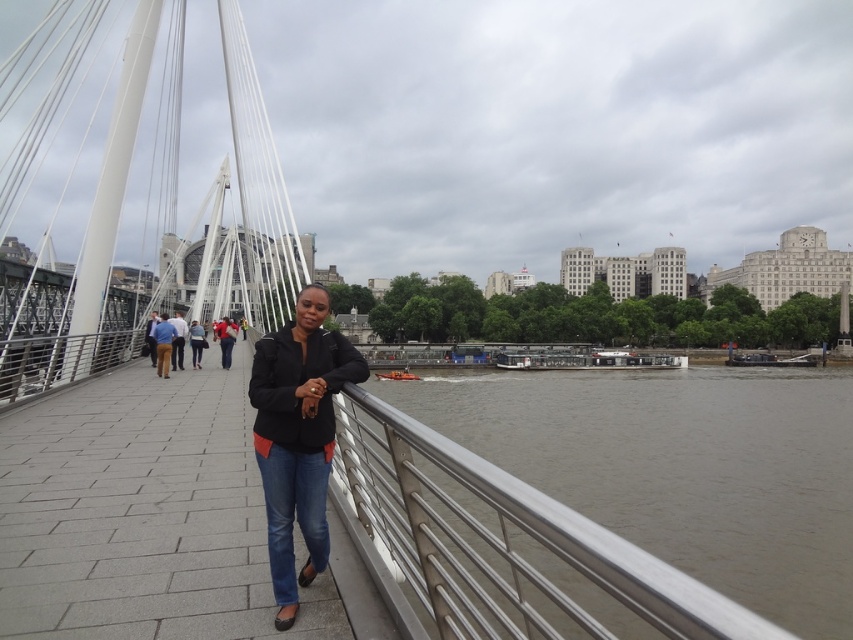
Consider the image. Does matte black jacket at center have a greater height compared to black matte jacket at center?

Indeed, matte black jacket at center has a greater height compared to black matte jacket at center.

How far apart are matte black jacket at center and black matte jacket at center?

They are 41.87 meters apart.

Image resolution: width=853 pixels, height=640 pixels. Find the location of `matte black jacket at center`. matte black jacket at center is located at coordinates (299, 436).

Which is in front, point (283, 620) or point (152, 364)?

Positioned in front is point (283, 620).

Does matte black jacket at center have a greater height compared to blue jeans at center?

Yes, matte black jacket at center is taller than blue jeans at center.

Does point (280, 452) come closer to viewer compared to point (149, 323)?

Yes.

This screenshot has height=640, width=853. Find the location of `matte black jacket at center`. matte black jacket at center is located at coordinates (299, 436).

Does black matte jacket at center have a smaller size compared to light brown leather jacket at center?

Correct, black matte jacket at center occupies less space than light brown leather jacket at center.

How distant is black matte jacket at center from light brown leather jacket at center?

A distance of 8.64 meters exists between black matte jacket at center and light brown leather jacket at center.

Identify the location of black matte jacket at center. (x=225, y=339).